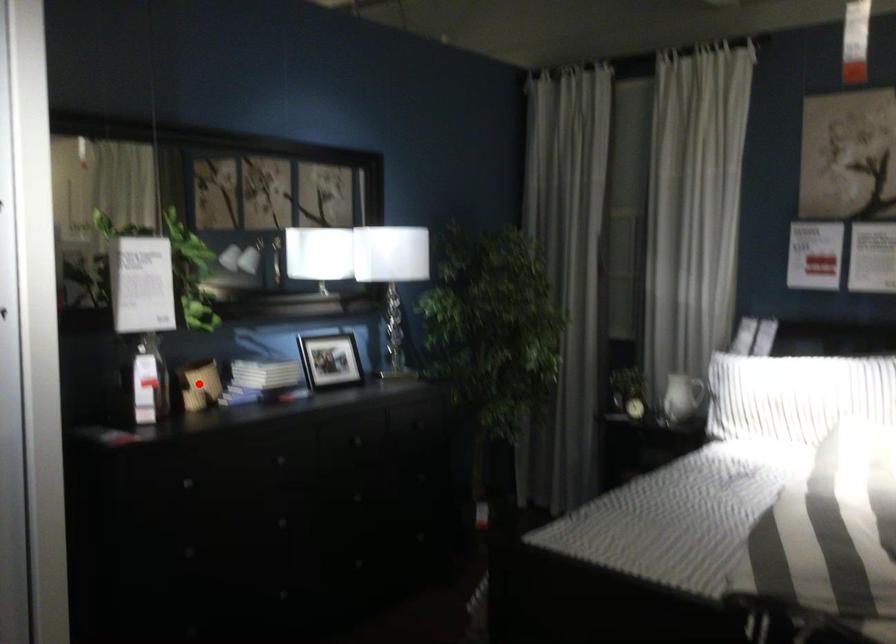
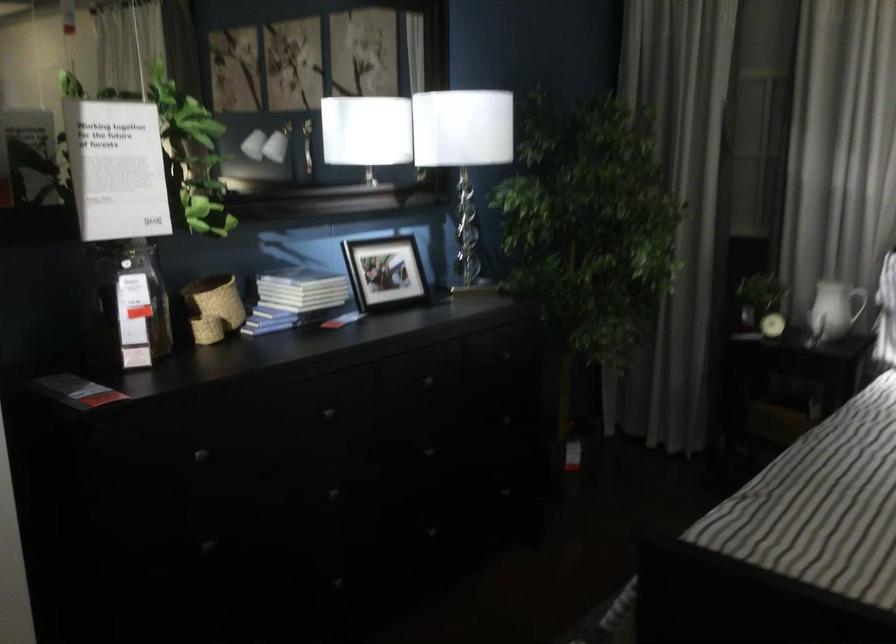
Locate, in the second image, the point that corresponds to the highlighted location in the first image.

(213, 307)